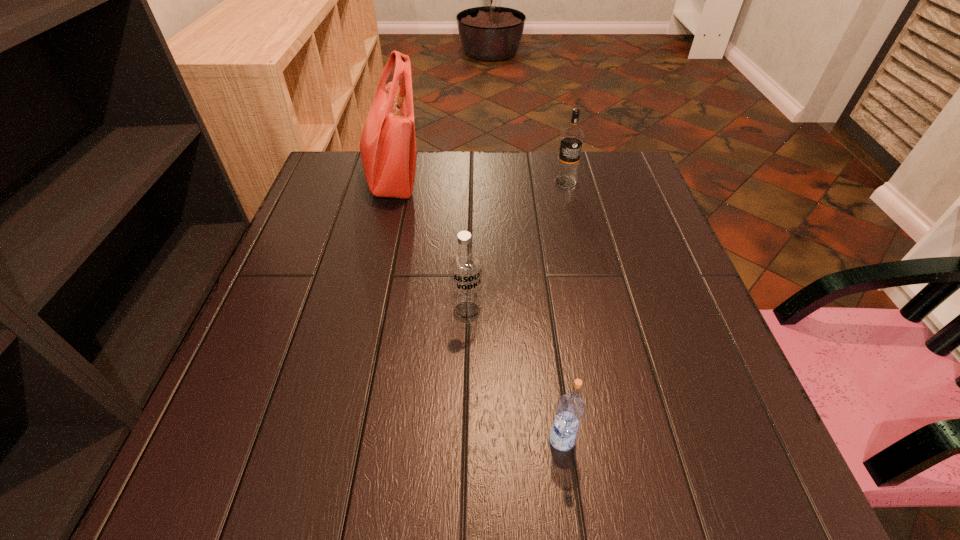
Locate an element on the screen. Image resolution: width=960 pixels, height=540 pixels. blank space that satisfies the following two spatial constraints: 1. on the front-facing side of the nearest vodka; 2. on the right side of the handbag is located at coordinates (327, 439).

What are the coordinates of `vacant space that satisfies the following two spatial constraints: 1. on the front label of the second vodka from left to right; 2. on the right side of the third object from right to left` in the screenshot? It's located at (464, 439).

The width and height of the screenshot is (960, 540). I want to click on free point that satisfies the following two spatial constraints: 1. on the front-facing side of the leftmost object; 2. on the back side of the third object from left to right, so click(327, 439).